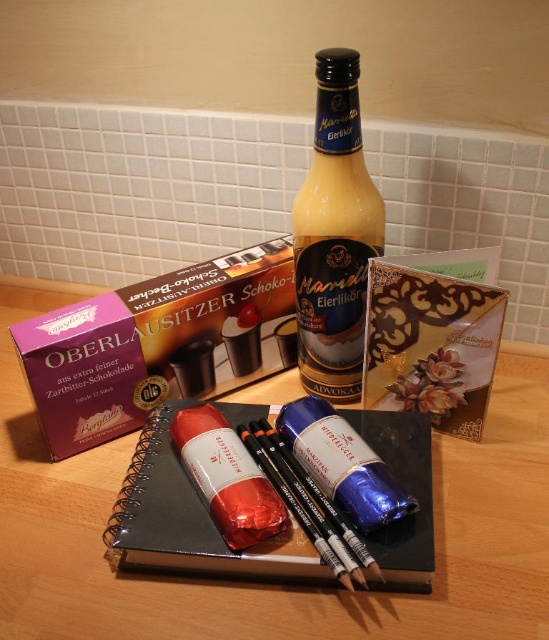
How much distance is there between wooden table at center and purple cardboard box at upper left?

wooden table at center is 6.70 inches away from purple cardboard box at upper left.

Between point (7, 579) and point (167, 392), which one is positioned in front?

Point (7, 579) is in front.

The height and width of the screenshot is (640, 549). I want to click on wooden table at center, so click(268, 586).

Can you confirm if wooden table at center is bigger than black matte notebook at center?

Correct, wooden table at center is larger in size than black matte notebook at center.

Is the position of wooden table at center less distant than that of black matte notebook at center?

Yes, it is.

Which is behind, point (66, 538) or point (125, 547)?

The point (66, 538) is behind.

Locate an element on the screen. The height and width of the screenshot is (640, 549). wooden table at center is located at coordinates tap(268, 586).

Is purple cardboard box at upper left bigger than black matte notebook at center?

Indeed, purple cardboard box at upper left has a larger size compared to black matte notebook at center.

Does purple cardboard box at upper left appear over black matte notebook at center?

Indeed, purple cardboard box at upper left is positioned over black matte notebook at center.

Who is more forward, [124,307] or [180,524]?

Point [180,524]

Image resolution: width=549 pixels, height=640 pixels. Identify the location of purple cardboard box at upper left. (159, 344).